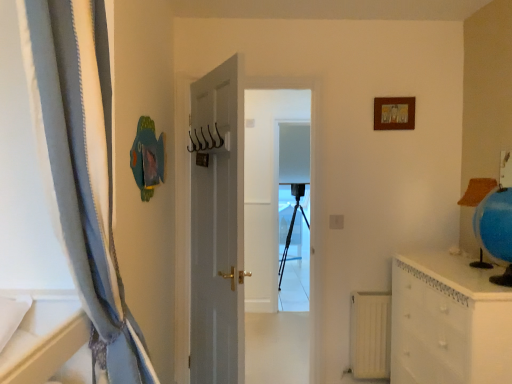
Question: Can you confirm if black matte tripod at center is wider than white glossy chest of drawers at right?

Choices:
 (A) yes
 (B) no

Answer: (A)

Question: Considering the relative sizes of black matte tripod at center and white glossy chest of drawers at right in the image provided, is black matte tripod at center smaller than white glossy chest of drawers at right?

Choices:
 (A) no
 (B) yes

Answer: (A)

Question: Is black matte tripod at center oriented towards white glossy chest of drawers at right?

Choices:
 (A) yes
 (B) no

Answer: (A)

Question: Is black matte tripod at center in front of white glossy chest of drawers at right?

Choices:
 (A) no
 (B) yes

Answer: (A)

Question: Does black matte tripod at center have a larger size compared to white glossy chest of drawers at right?

Choices:
 (A) no
 (B) yes

Answer: (B)

Question: Is black matte tripod at center positioned beyond the bounds of white glossy chest of drawers at right?

Choices:
 (A) no
 (B) yes

Answer: (B)

Question: From a real-world perspective, is blue fabric curtain at left located beneath white glossy chest of drawers at right?

Choices:
 (A) no
 (B) yes

Answer: (A)

Question: Is blue fabric curtain at left far from white glossy chest of drawers at right?

Choices:
 (A) no
 (B) yes

Answer: (B)

Question: Is white glossy chest of drawers at right at the back of blue fabric curtain at left?

Choices:
 (A) no
 (B) yes

Answer: (A)

Question: Can you confirm if blue fabric curtain at left is taller than white glossy chest of drawers at right?

Choices:
 (A) yes
 (B) no

Answer: (A)

Question: Is blue fabric curtain at left positioned before white glossy chest of drawers at right?

Choices:
 (A) no
 (B) yes

Answer: (B)

Question: Is blue fabric curtain at left shorter than white glossy chest of drawers at right?

Choices:
 (A) yes
 (B) no

Answer: (B)

Question: Can you confirm if metallic hooks at center is taller than black matte tripod at center?

Choices:
 (A) no
 (B) yes

Answer: (A)